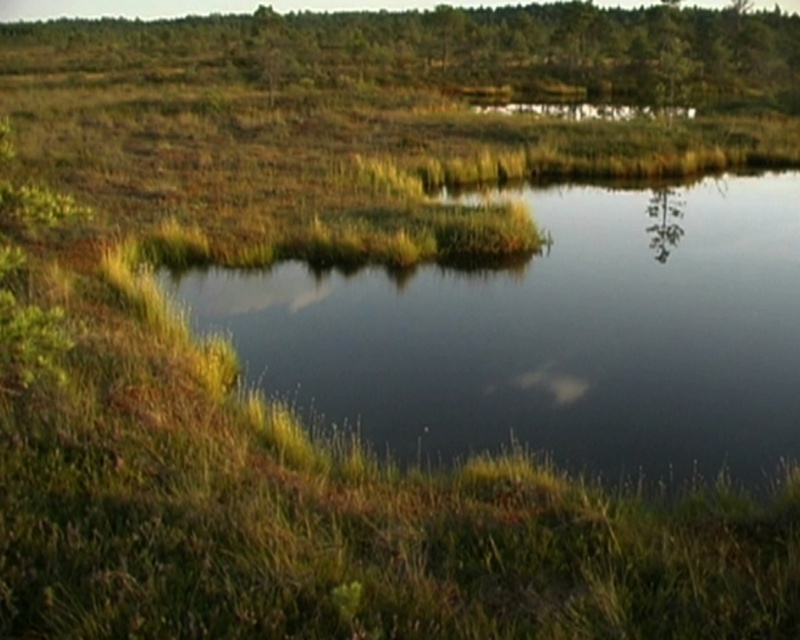
Question: Which point is closer to the camera?

Choices:
 (A) green grassy lake at center
 (B) green matte tree at upper center

Answer: (A)

Question: Does green grassy lake at center appear under green matte tree at upper center?

Choices:
 (A) no
 (B) yes

Answer: (B)

Question: Which point is farther to the camera?

Choices:
 (A) green matte tree at upper center
 (B) green grassy lake at center

Answer: (A)

Question: Observing the image, what is the correct spatial positioning of green grassy lake at center in reference to green matte tree at upper center?

Choices:
 (A) left
 (B) right

Answer: (B)

Question: Can you confirm if green grassy lake at center is thinner than green matte tree at upper center?

Choices:
 (A) yes
 (B) no

Answer: (A)

Question: Which point is farther to the camera?

Choices:
 (A) (678, 241)
 (B) (325, 29)

Answer: (B)